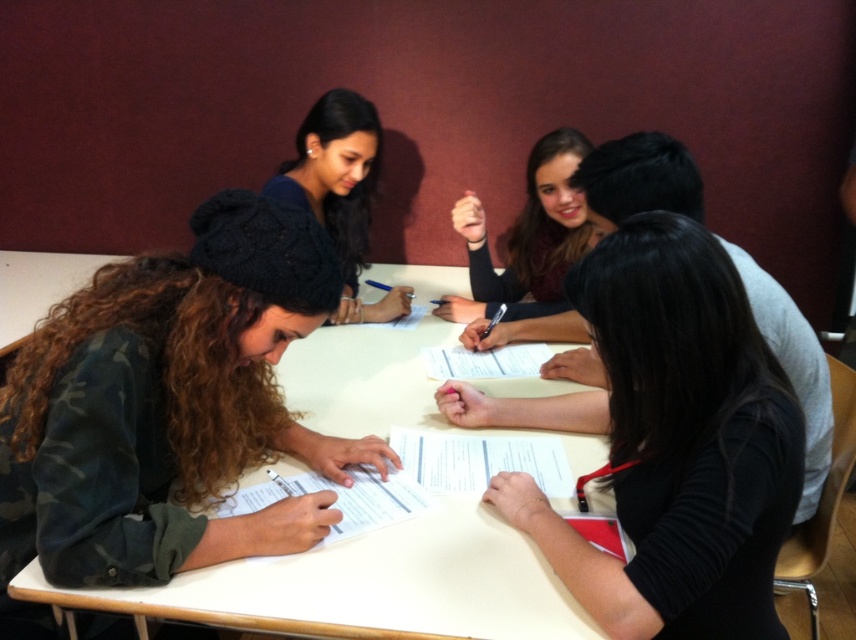
Can you confirm if camo fabric beanie at lower left is positioned below smooth black hair at center?

Correct, camo fabric beanie at lower left is located below smooth black hair at center.

Who is positioned more to the left, camo fabric beanie at lower left or smooth black hair at center?

Positioned to the left is camo fabric beanie at lower left.

Who is more forward, (140, 545) or (483, 259)?

Point (140, 545)

At what (x,y) coordinates should I click in order to perform the action: click on camo fabric beanie at lower left. Please return your answer as a coordinate pair (x, y). Looking at the image, I should click on (169, 404).

Looking at this image, can you confirm if smooth black hair at center is positioned above matte black beanie at upper center?

Actually, smooth black hair at center is below matte black beanie at upper center.

Is point (495, 291) closer to viewer compared to point (328, 166)?

No, it is behind (328, 166).

Where is `smooth black hair at center`? smooth black hair at center is located at coordinates (526, 237).

Does white paper at center have a smaller size compared to matte black beanie at upper center?

Incorrect, white paper at center is not smaller in size than matte black beanie at upper center.

Does white paper at center have a greater height compared to matte black beanie at upper center?

In fact, white paper at center may be shorter than matte black beanie at upper center.

Is point (262, 611) positioned before point (330, 93)?

Yes, point (262, 611) is in front of point (330, 93).

Identify the location of white paper at center. (367, 586).